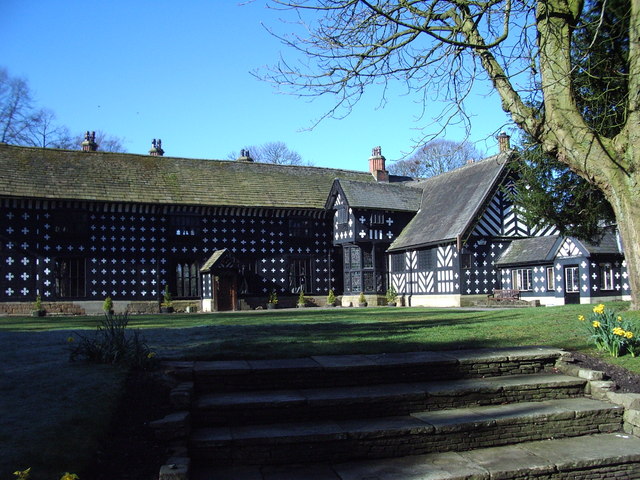
This screenshot has height=480, width=640. In order to click on door in this screenshot , I will do `click(569, 281)`.